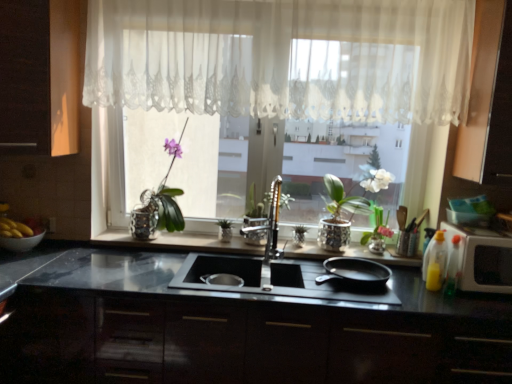
Question: Is polished chrome faucet at center surrounding yellow matte bananas at left?

Choices:
 (A) yes
 (B) no

Answer: (B)

Question: Can you confirm if polished chrome faucet at center is positioned to the right of yellow matte bananas at left?

Choices:
 (A) no
 (B) yes

Answer: (B)

Question: Can you confirm if polished chrome faucet at center is shorter than yellow matte bananas at left?

Choices:
 (A) yes
 (B) no

Answer: (B)

Question: From the image's perspective, is polished chrome faucet at center located beneath yellow matte bananas at left?

Choices:
 (A) no
 (B) yes

Answer: (A)

Question: Is polished chrome faucet at center beside yellow matte bananas at left?

Choices:
 (A) yes
 (B) no

Answer: (B)

Question: From their relative heights in the image, would you say white glossy microwave at right is taller or shorter than yellow translucent bottle at right, which is the 2th bottle in left-to-right order?

Choices:
 (A) tall
 (B) short

Answer: (B)

Question: Is white glossy microwave at right bigger or smaller than yellow translucent bottle at right, which is the 2th bottle in left-to-right order?

Choices:
 (A) small
 (B) big

Answer: (B)

Question: Considering the positions of point (482, 243) and point (453, 271), is point (482, 243) closer or farther from the camera than point (453, 271)?

Choices:
 (A) farther
 (B) closer

Answer: (B)

Question: Is white glossy microwave at right in front of or behind yellow translucent bottle at right, which is the 2th bottle in left-to-right order, in the image?

Choices:
 (A) behind
 (B) front

Answer: (B)

Question: From the image's perspective, is translucent plastic bottle at right, the second bottle in the right-to-left sequence, positioned above or below dark wood cabinet at left, the third cabinetry from the bottom?

Choices:
 (A) below
 (B) above

Answer: (A)

Question: Considering their positions, is translucent plastic bottle at right, which ranks as the 1th bottle in left-to-right order, located in front of or behind dark wood cabinet at left, arranged as the first cabinetry when viewed from the left?

Choices:
 (A) front
 (B) behind

Answer: (B)

Question: Is point (428, 273) positioned closer to the camera than point (65, 139)?

Choices:
 (A) closer
 (B) farther

Answer: (A)

Question: From a real-world perspective, is translucent plastic bottle at right, which ranks as the 1th bottle in left-to-right order, physically located above or below dark wood cabinet at left, the third cabinetry from the bottom?

Choices:
 (A) above
 (B) below

Answer: (B)

Question: Considering the positions of black matte frying pan at right and black glossy cabinetry at center, which is the 3th cabinetry from top to bottom, in the image, is black matte frying pan at right taller or shorter than black glossy cabinetry at center, which is the 3th cabinetry from top to bottom,?

Choices:
 (A) tall
 (B) short

Answer: (B)

Question: Does point (357, 276) appear closer or farther from the camera than point (322, 357)?

Choices:
 (A) farther
 (B) closer

Answer: (A)